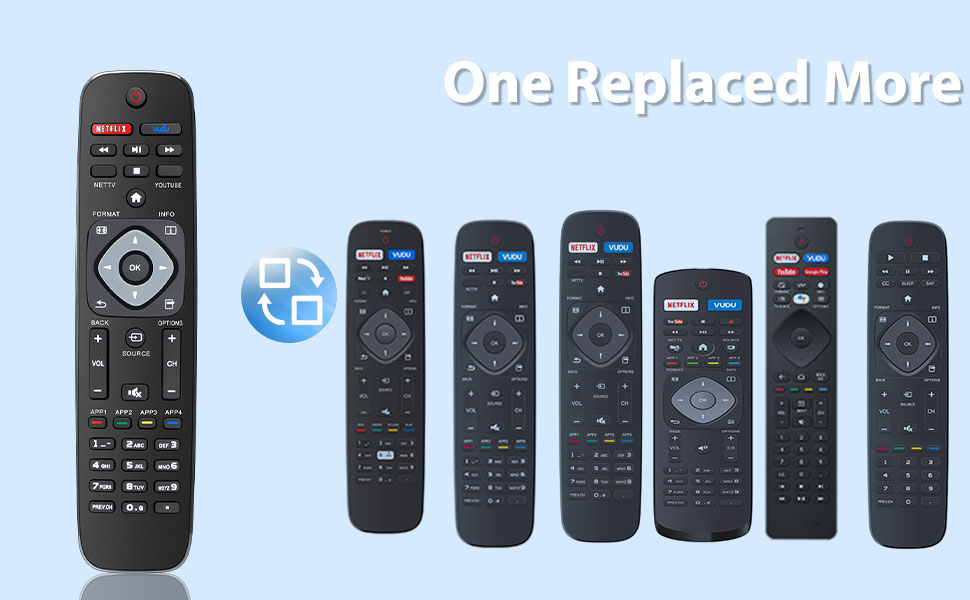
The height and width of the screenshot is (600, 970). Find the location of `remote control`. remote control is located at coordinates (128, 547), (378, 503), (487, 518), (595, 518), (699, 508), (806, 512), (900, 511).